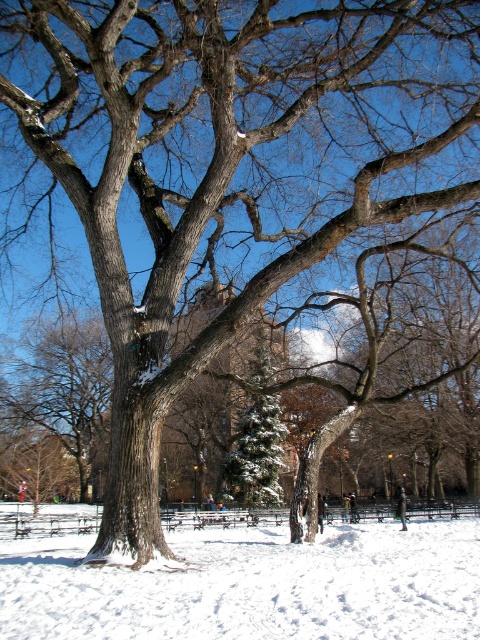
Can you confirm if white powdery snow at center is wider than green snowy evergreen at center?

Correct, the width of white powdery snow at center exceeds that of green snowy evergreen at center.

Is point (0, 556) farther from camera compared to point (273, 445)?

No, it is in front of (273, 445).

The height and width of the screenshot is (640, 480). What are the coordinates of `white powdery snow at center` in the screenshot? It's located at (252, 586).

Find the location of a particular element. Image resolution: width=480 pixels, height=640 pixels. white powdery snow at center is located at coordinates (252, 586).